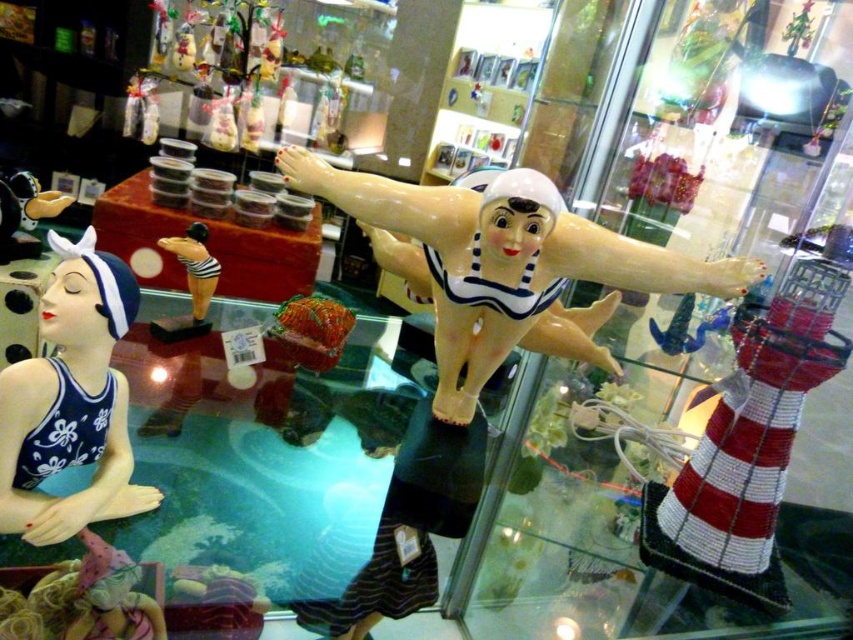
Is point (718, 497) less distant than point (186, 323)?

Yes, point (718, 497) is in front of point (186, 323).

Who is taller, red and white beaded lighthouse at center or matte black swimsuit at center?

Standing taller between the two is red and white beaded lighthouse at center.

Does point (722, 467) come behind point (199, 305)?

No, (722, 467) is closer to viewer.

Where is `red and white beaded lighthouse at center`? red and white beaded lighthouse at center is located at coordinates (752, 435).

Does point (19, 204) lie behind point (196, 310)?

No, it is not.

Between point (33, 180) and point (190, 280), which one is positioned behind?

Positioned behind is point (190, 280).

This screenshot has width=853, height=640. What do you see at coordinates (24, 212) in the screenshot?
I see `matte black rubber duck at upper left` at bounding box center [24, 212].

This screenshot has height=640, width=853. In order to click on matte black rubber duck at upper left in this screenshot , I will do [x=24, y=212].

Does red and white beaded lighthouse at center have a lesser height compared to matte black rubber duck at upper left?

No, red and white beaded lighthouse at center is not shorter than matte black rubber duck at upper left.

Locate an element on the screen. The height and width of the screenshot is (640, 853). red and white beaded lighthouse at center is located at coordinates [x=752, y=435].

Image resolution: width=853 pixels, height=640 pixels. Identify the location of red and white beaded lighthouse at center. (752, 435).